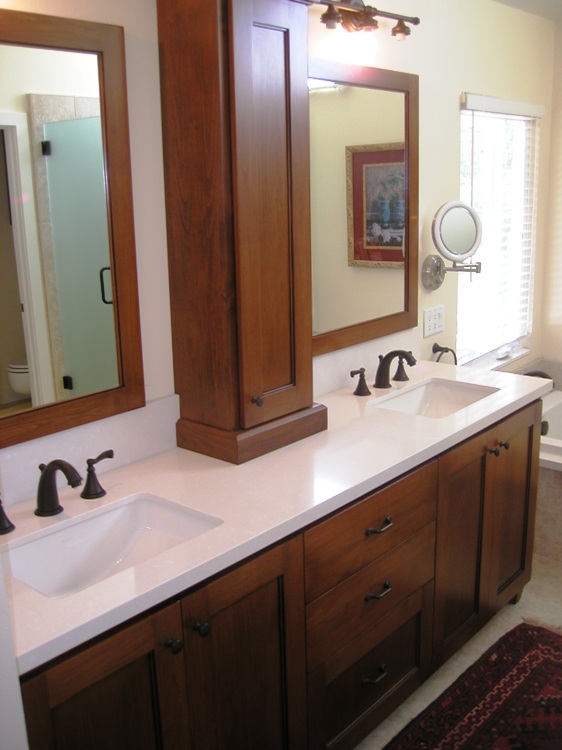
I want to click on curved sink faucet, so click(49, 468), click(395, 352).